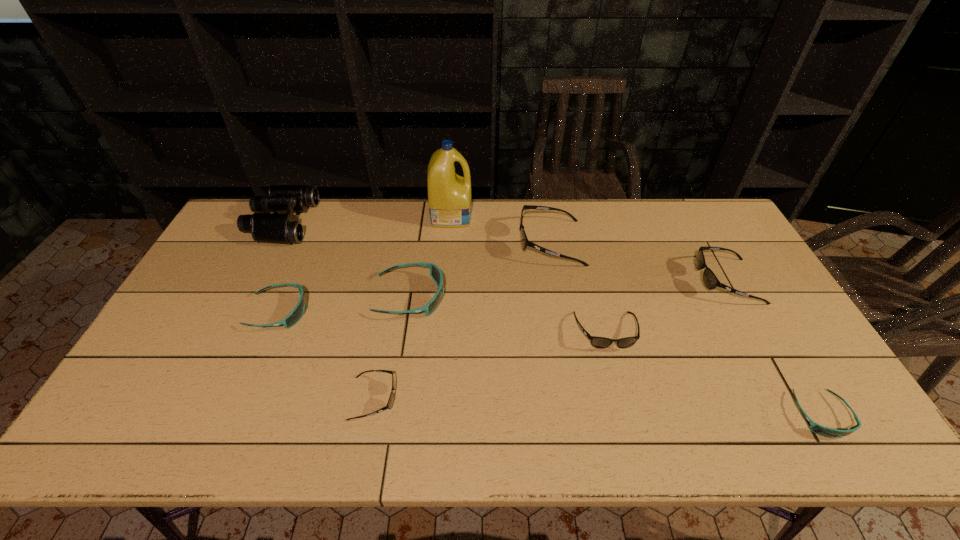
You are a GUI agent. You are given a task and a screenshot of the screen. Output one action in this format:
    pyautogui.click(x=<x>, y=<y>)
    Task: Click on the free space between the second nearest gray sunglasses and the biggest gray sunglasses
    This screenshot has width=960, height=540.
    Given the screenshot: What is the action you would take?
    [578, 287]

Where is `free space between the second smallest cyan sunglasses and the nearest gray sunglasses`? This screenshot has width=960, height=540. free space between the second smallest cyan sunglasses and the nearest gray sunglasses is located at coordinates (325, 355).

The height and width of the screenshot is (540, 960). I want to click on unoccupied area between the smallest cyan sunglasses and the third farthest gray sunglasses, so [713, 374].

At what (x,y) coordinates should I click in order to perform the action: click on free space between the smallest gray sunglasses and the third biggest gray sunglasses. Please return your answer as a coordinate pair (x, y). This screenshot has width=960, height=540. Looking at the image, I should click on (490, 365).

In order to click on vacant space in between the third biggest gray sunglasses and the black binoculars in this screenshot , I will do `click(444, 277)`.

I want to click on vacant space that's between the rightmost gray sunglasses and the detergent, so click(x=588, y=248).

You are a GUI agent. You are given a task and a screenshot of the screen. Output one action in this format:
    pyautogui.click(x=<x>, y=<y>)
    Task: Click on the free space between the rightmost gray sunglasses and the second smallest cyan sunglasses
    
    Given the screenshot: What is the action you would take?
    pyautogui.click(x=502, y=296)

Locate which object is the fifth closest to the third farthest gray sunglasses. Please provide its 2D coordinates. Your answer should be formatted as a tuple, i.e. [(x, y)], where the tuple contains the x and y coordinates of a point satisfying the conditions above.

[(390, 402)]

You are a GUI agent. You are given a task and a screenshot of the screen. Output one action in this format:
    pyautogui.click(x=<x>, y=<y>)
    Task: Click on the object that is the fifth closest one to the smallest gray sunglasses
    The height and width of the screenshot is (540, 960).
    Given the screenshot: What is the action you would take?
    pyautogui.click(x=285, y=228)

This screenshot has height=540, width=960. I want to click on sunglasses that is the third closest to the seventh shortest object, so click(x=710, y=280).